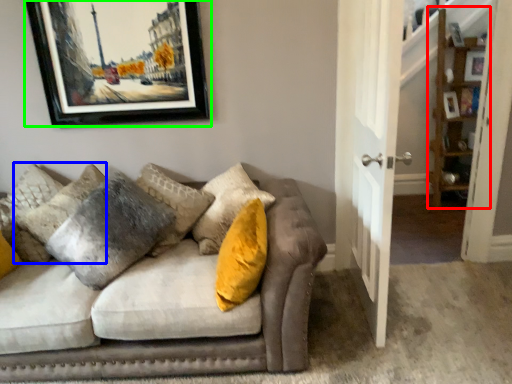
Question: Estimate the real-world distances between objects in this image. Which object is farther from shelf (highlighted by a red box), pillow (highlighted by a blue box) or picture frame (highlighted by a green box)?

Choices:
 (A) pillow
 (B) picture frame

Answer: (A)